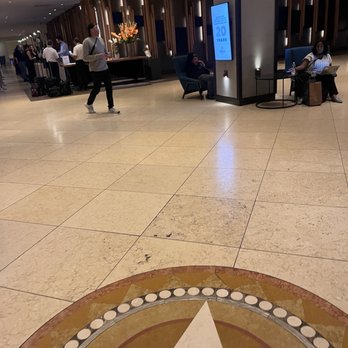
Identify the location of table. (275, 75).